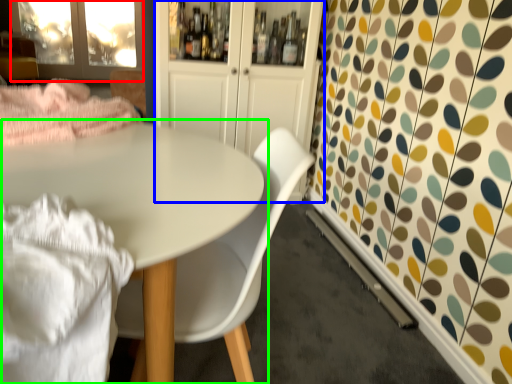
Question: Considering the real-world distances, which object is farthest from screen door (highlighted by a red box)? dresser (highlighted by a blue box) or table (highlighted by a green box)?

Choices:
 (A) dresser
 (B) table

Answer: (B)